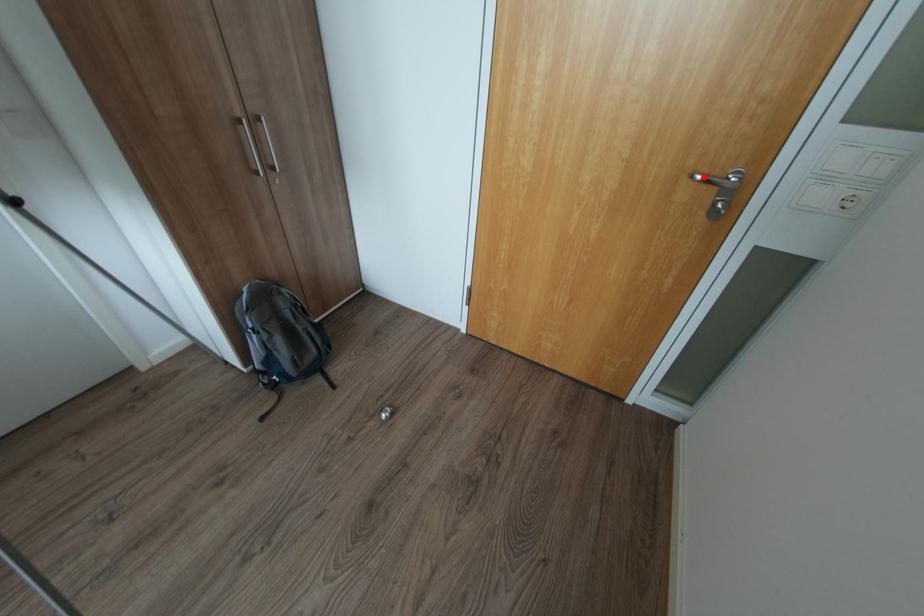
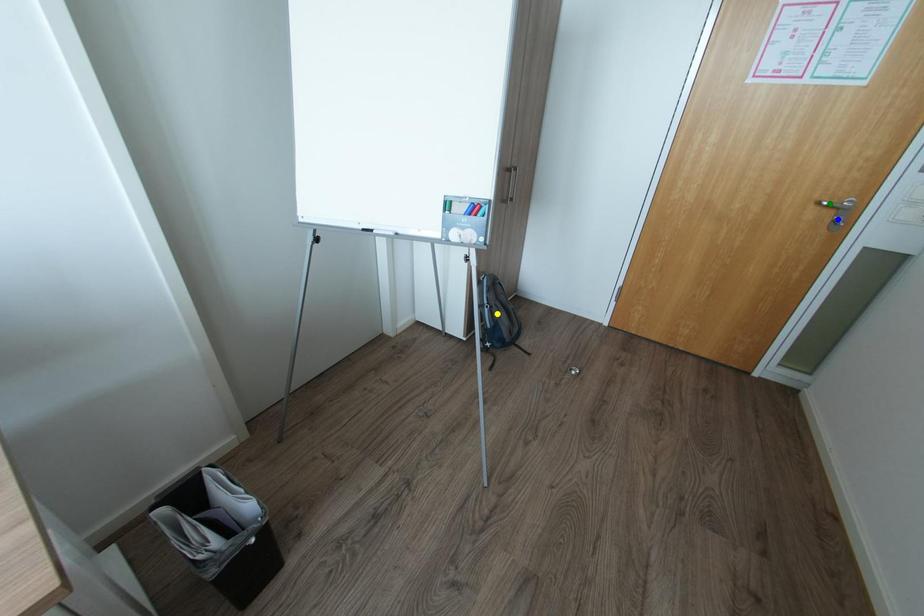
Question: I am providing you with two images of the same scene from different viewpoints. A red point is marked on the first image. You are given multiple points on the second image. Which mark in image 2 goes with the point in image 1?

Choices:
 (A) green point
 (B) yellow point
 (C) blue point

Answer: (A)